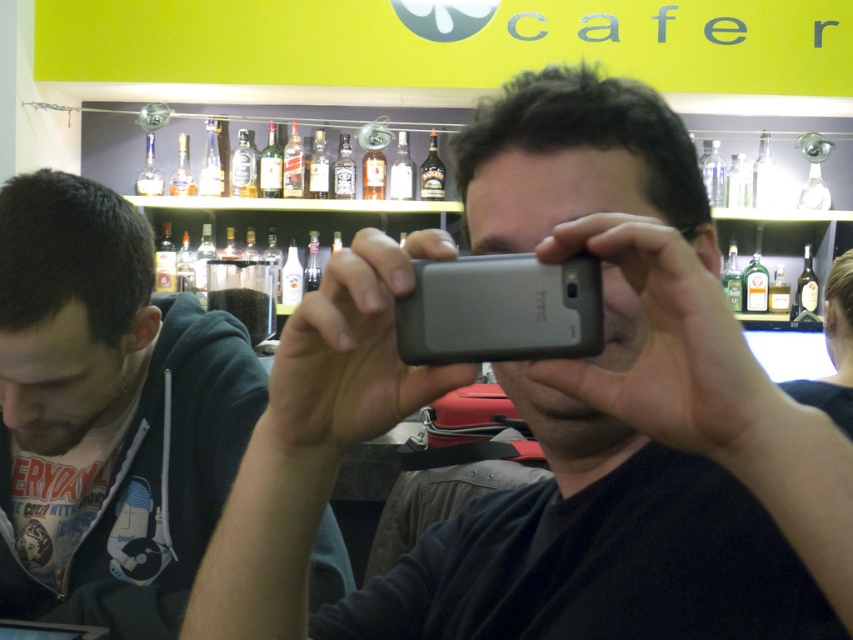
Question: Which object is positioned closest to the gray matte htc phone at center?

Choices:
 (A) dark blue hoodie at left
 (B) gray matte phone at center

Answer: (B)

Question: Can you confirm if dark blue hoodie at left is positioned above gray matte htc phone at center?

Choices:
 (A) no
 (B) yes

Answer: (A)

Question: Does gray matte phone at center appear under gray matte htc phone at center?

Choices:
 (A) yes
 (B) no

Answer: (A)

Question: Estimate the real-world distances between objects in this image. Which object is closer to the gray matte phone at center?

Choices:
 (A) gray matte htc phone at center
 (B) dark blue hoodie at left

Answer: (A)

Question: Which of the following is the closest to the observer?

Choices:
 (A) gray matte phone at center
 (B) gray matte htc phone at center

Answer: (A)

Question: Does gray matte phone at center appear on the right side of gray matte htc phone at center?

Choices:
 (A) no
 (B) yes

Answer: (B)